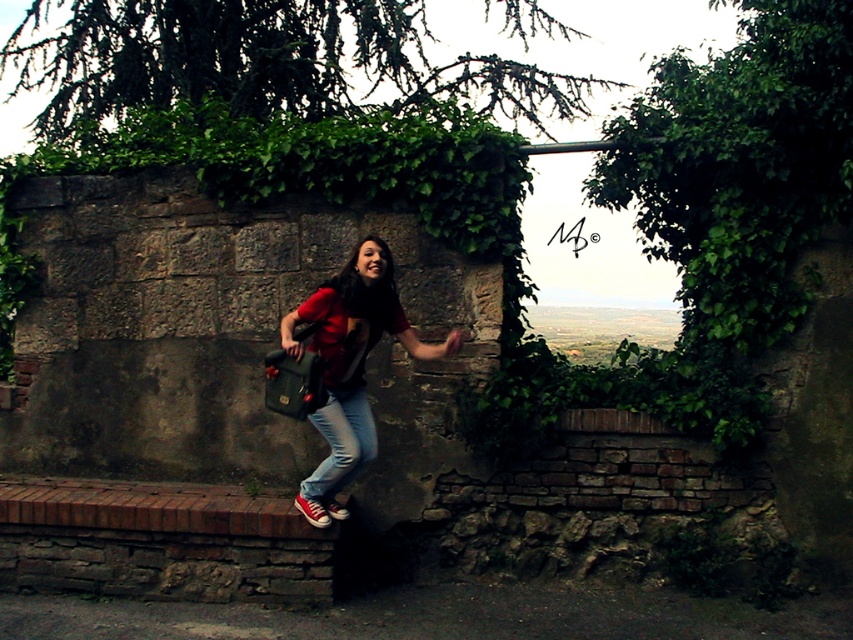
You are designing a costume for a play and need to ensure the proportions of the clothing items match the character. Given the matte red shirt at center and jeans at center, which clothing item has a greater width?

The matte red shirt at center has a greater width than the jeans at center.

You are a photographer trying to capture the person in the scene. Since the matte red shirt at center and jeans at center are both at the center, can you tell me which one is positioned more to the right?

The matte red shirt at center is positioned more to the right than the jeans at center.

You are a fashion designer analyzing a photo of a person wearing a matte red shirt at center and jeans at center. Based on the image, which clothing item appears taller on the person?

The matte red shirt at center is much taller than the jeans at center, so the matte red shirt at center appears taller.